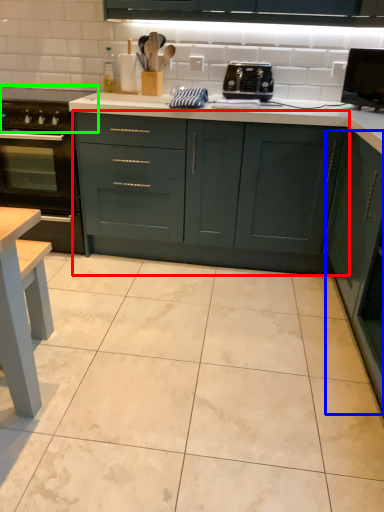
Question: Estimate the real-world distances between objects in this image. Which object is closer to cabinetry (highlighted by a red box), cabinetry (highlighted by a blue box) or gas stove (highlighted by a green box)?

Choices:
 (A) cabinetry
 (B) gas stove

Answer: (A)